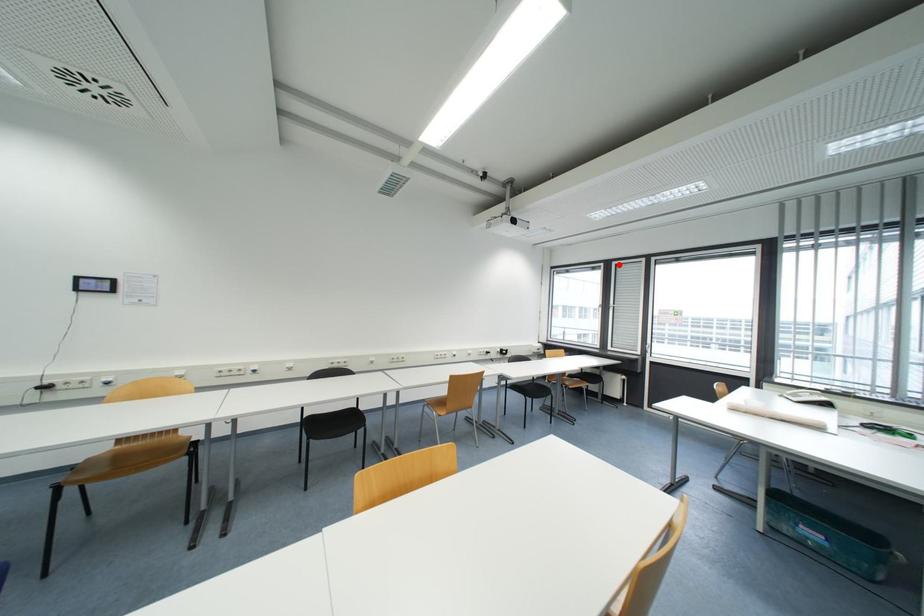
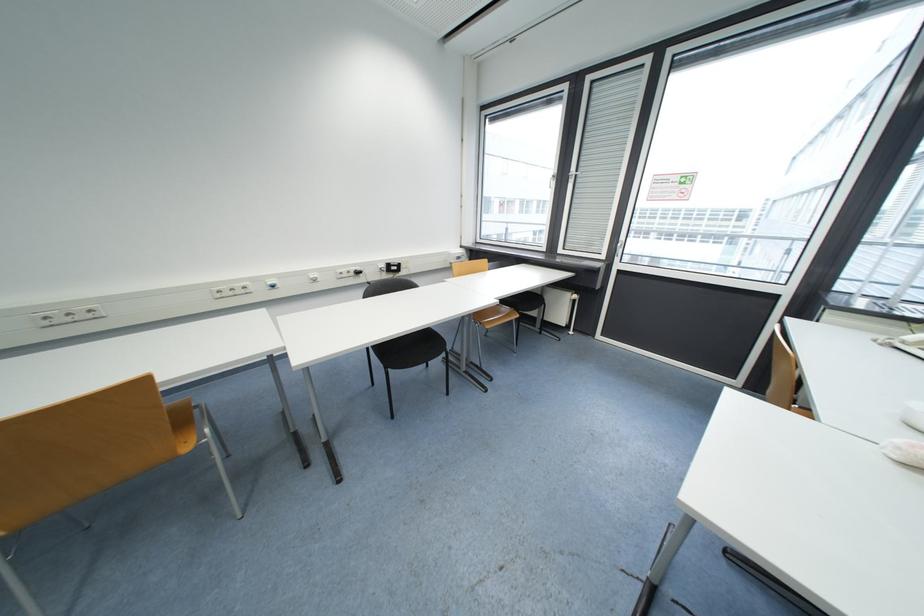
Where in the second image is the point corresponding to the highlighted location from the first image?

(593, 81)